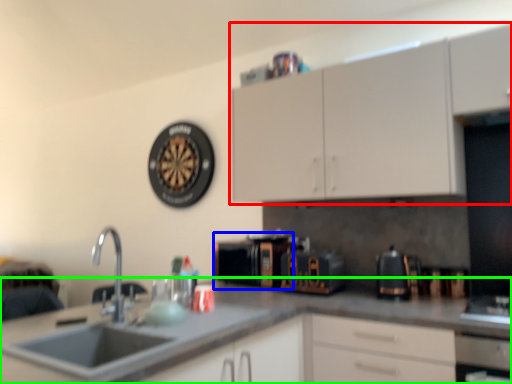
Question: Estimate the real-world distances between objects in this image. Which object is closer to cabinetry (highlighted by a red box), appliance (highlighted by a blue box) or countertop (highlighted by a green box)?

Choices:
 (A) appliance
 (B) countertop

Answer: (A)